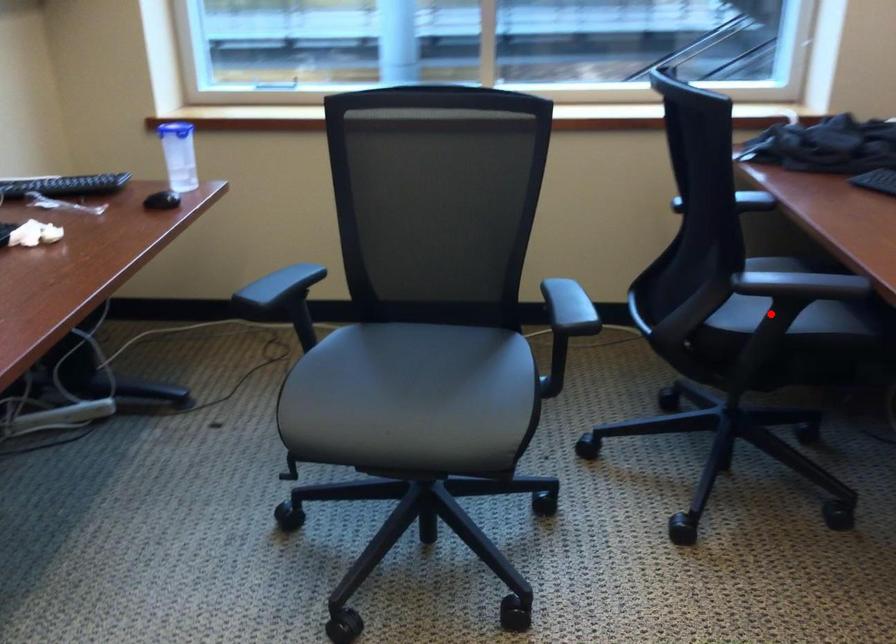
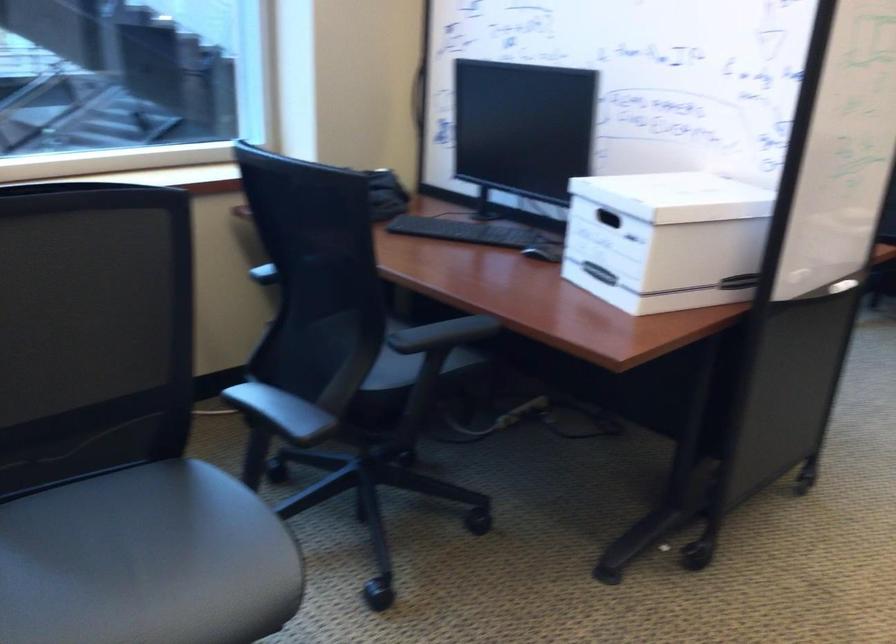
Find the pixel in the second image that matches the highlighted location in the first image.

(410, 368)